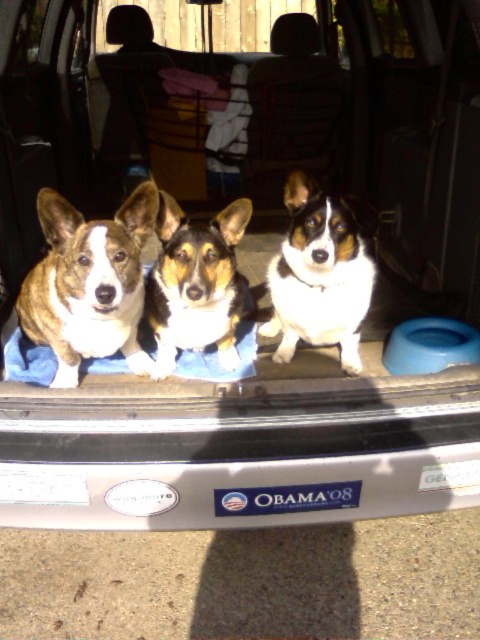
Is brown and white fur dog at center bigger than white fur dog at center?

Yes, brown and white fur dog at center is bigger than white fur dog at center.

Does brown and white fur dog at center appear over white fur dog at center?

Incorrect, brown and white fur dog at center is not positioned above white fur dog at center.

Which is behind, point (136, 240) or point (288, 305)?

Positioned behind is point (288, 305).

This screenshot has width=480, height=640. What are the coordinates of `brown and white fur dog at center` in the screenshot? It's located at (88, 284).

Does point (124, 328) come farther from viewer compared to point (159, 376)?

That is False.

Who is more distant from viewer, (51, 212) or (223, 308)?

The point (223, 308) is more distant.

Identify the location of brown and white fur dog at center. (88, 284).

Where is `brown and white fur dog at center`? Image resolution: width=480 pixels, height=640 pixels. brown and white fur dog at center is located at coordinates (88, 284).

Who is shorter, white fur dog at center or brown and white fur at center?

brown and white fur at center is shorter.

Where is `white fur dog at center`? white fur dog at center is located at coordinates (319, 276).